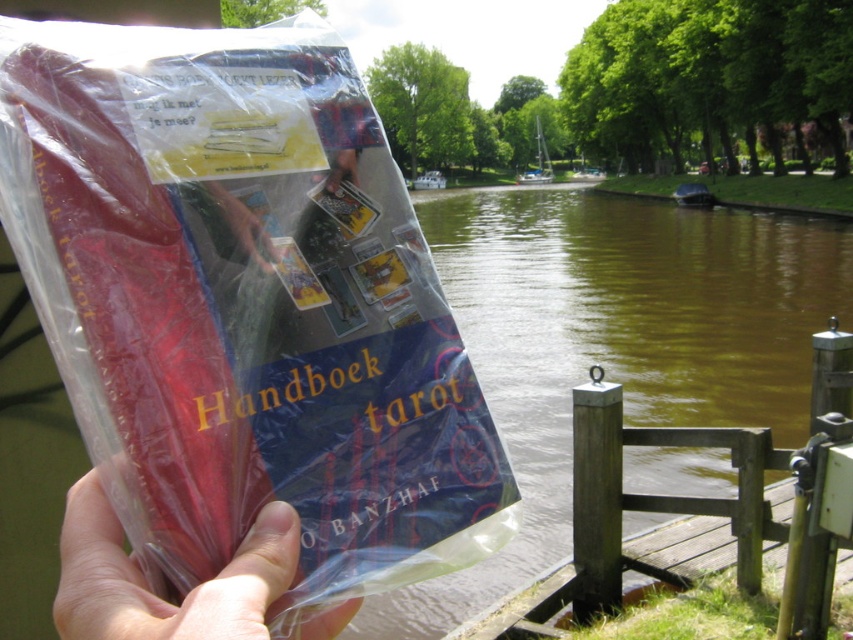
Which is in front, point (196, 237) or point (91, 513)?

Point (91, 513) is in front.

Who is taller, transparent plastic bag at center or matte plastic hand at center?

Standing taller between the two is transparent plastic bag at center.

The image size is (853, 640). What do you see at coordinates (244, 301) in the screenshot?
I see `transparent plastic bag at center` at bounding box center [244, 301].

I want to click on transparent plastic bag at center, so click(x=244, y=301).